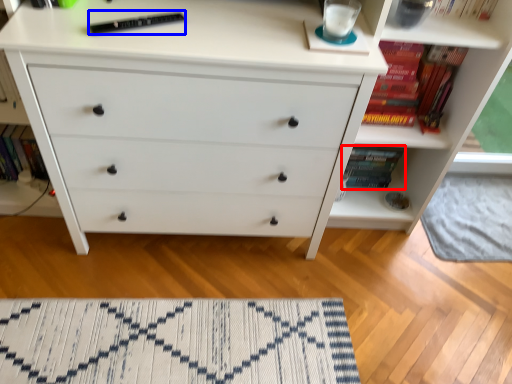
Question: Which of the following is the closest to the observer, book (highlighted by a red box) or book (highlighted by a blue box)?

Choices:
 (A) book
 (B) book

Answer: (B)